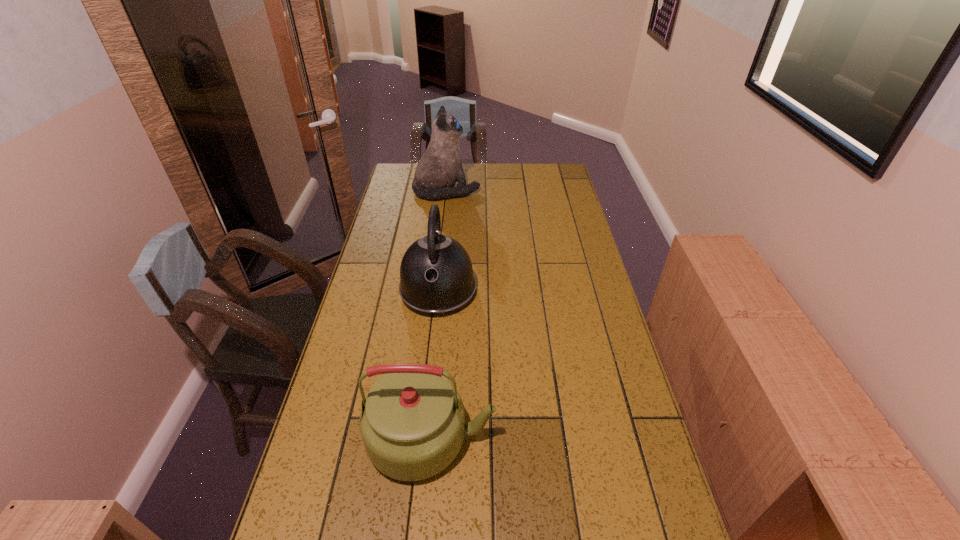
Where is `the farthest object`? This screenshot has height=540, width=960. the farthest object is located at coordinates (440, 167).

The width and height of the screenshot is (960, 540). Find the location of `the farther kettle`. the farther kettle is located at coordinates point(436,276).

The width and height of the screenshot is (960, 540). In order to click on the nearest object in this screenshot , I will do `click(412, 423)`.

In order to click on free location located at the face of the cat in this screenshot , I will do `click(526, 191)`.

You are a GUI agent. You are given a task and a screenshot of the screen. Output one action in this format:
    pyautogui.click(x=<x>, y=<y>)
    Task: Click on the vacant area located 0.220m on the spout of the second farthest object
    
    Given the screenshot: What is the action you would take?
    pyautogui.click(x=429, y=380)

Where is `free spot located 0.340m at the spout of the nearest object`? Image resolution: width=960 pixels, height=540 pixels. free spot located 0.340m at the spout of the nearest object is located at coordinates (632, 437).

Identify the location of object that is positioned at the far edge. (440, 167).

This screenshot has width=960, height=540. Identify the location of cat present at the left edge. (440, 167).

I want to click on object at the far left corner, so click(440, 167).

Find the location of a particular element. This screenshot has height=540, width=960. free space at the far edge of the desktop is located at coordinates (513, 178).